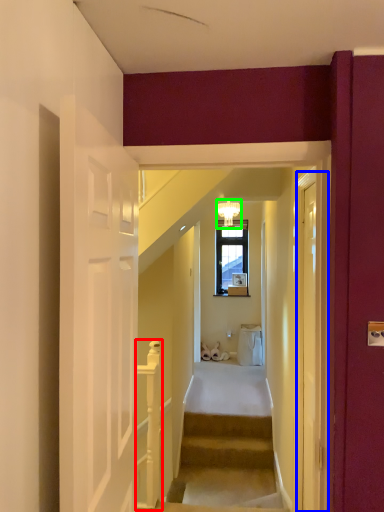
Question: Which is nearer to the rail (highlighted by a red box)? glass door (highlighted by a blue box) or light fixture (highlighted by a green box).

Choices:
 (A) glass door
 (B) light fixture

Answer: (A)